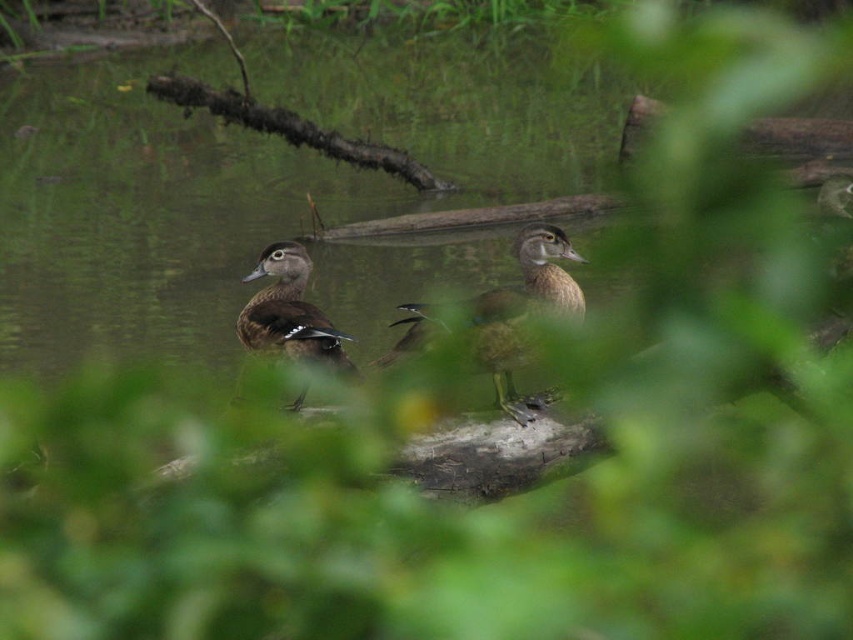
Question: Is the position of brown glossy duck at center less distant than that of brown matte duck at center?

Choices:
 (A) no
 (B) yes

Answer: (B)

Question: Which object appears closest to the camera in this image?

Choices:
 (A) brown glossy duck at center
 (B) brown matte duck at center

Answer: (A)

Question: Does brown glossy duck at center appear on the left side of brown matte duck at center?

Choices:
 (A) yes
 (B) no

Answer: (B)

Question: Which of the following is the closest to the observer?

Choices:
 (A) (303, 349)
 (B) (491, 364)

Answer: (B)

Question: Does brown glossy duck at center appear on the right side of brown matte duck at center?

Choices:
 (A) yes
 (B) no

Answer: (A)